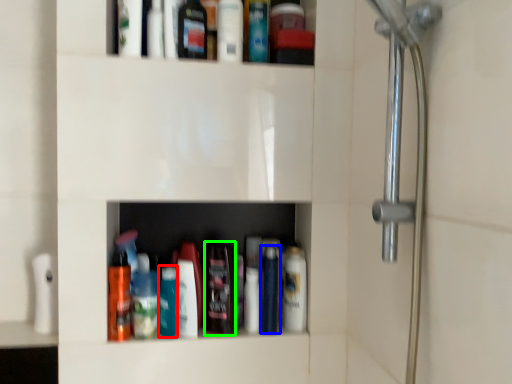
Question: Based on their relative distances, which object is nearer to bottle (highlighted by a red box)? Choose from mouthwash (highlighted by a blue box) and mouthwash (highlighted by a green box).

Choices:
 (A) mouthwash
 (B) mouthwash

Answer: (B)